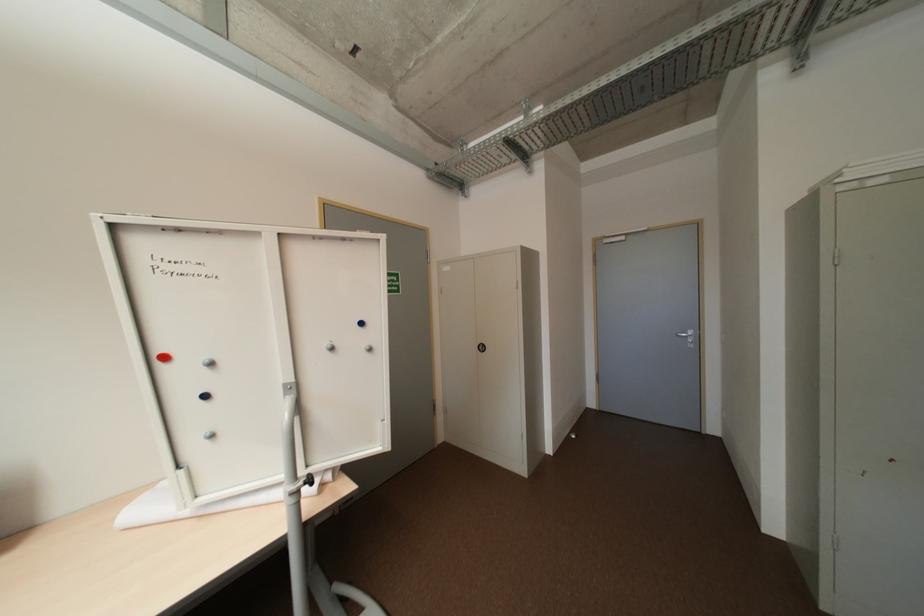
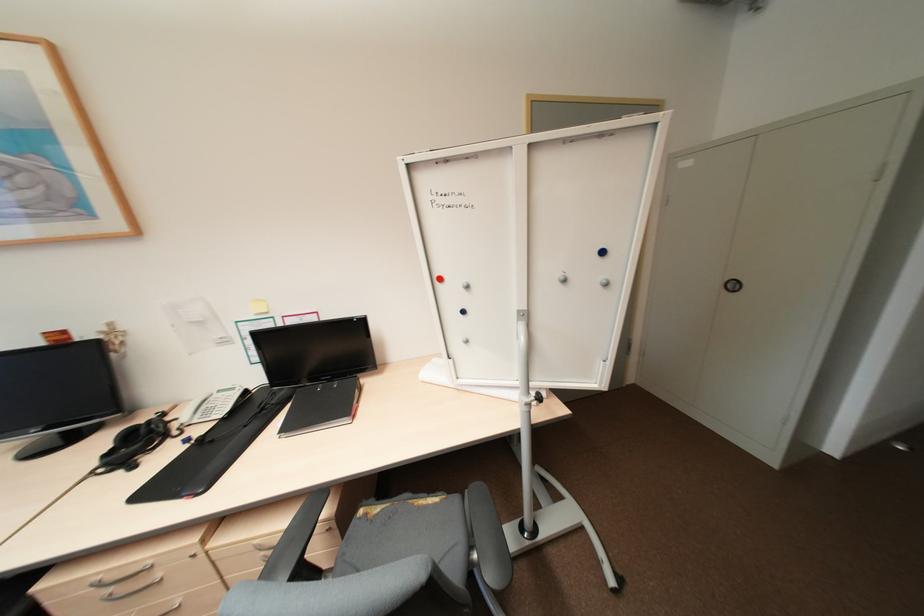
The point at (375,350) is marked in the first image. Where is the corresponding point in the second image?

(612, 284)